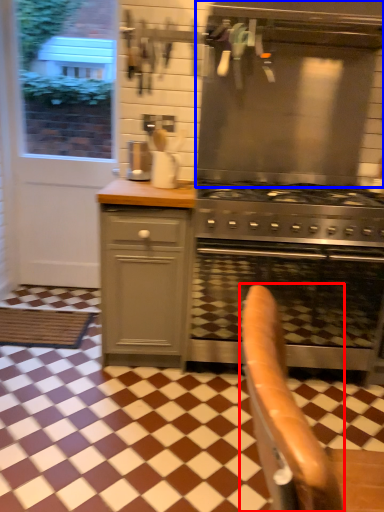
Question: Which object is closer to the camera taking this photo, armchair (highlighted by a red box) or vent (highlighted by a blue box)?

Choices:
 (A) armchair
 (B) vent

Answer: (A)